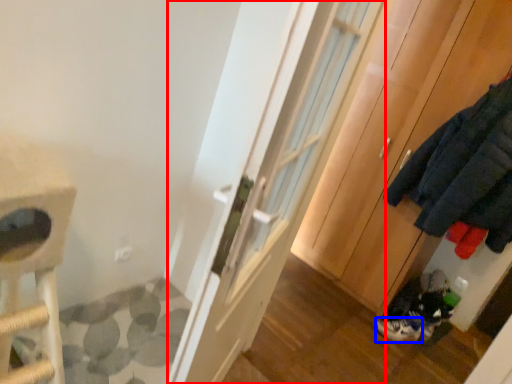
Question: Among these objects, which one is nearest to the camera, door (highlighted by a red box) or footwear (highlighted by a blue box)?

Choices:
 (A) door
 (B) footwear

Answer: (A)